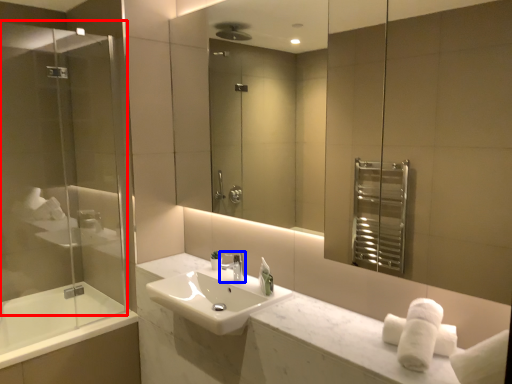
Question: Among these objects, which one is farthest to the camera, screen door (highlighted by a red box) or tap (highlighted by a blue box)?

Choices:
 (A) screen door
 (B) tap

Answer: (B)